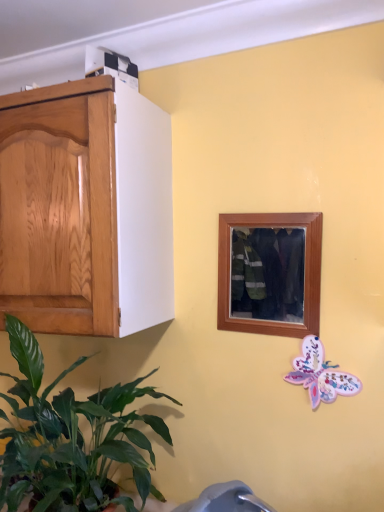
Question: From the image's perspective, does green leafy plant at lower left appear lower than wooden picture frame at center?

Choices:
 (A) yes
 (B) no

Answer: (A)

Question: Is green leafy plant at lower left located outside wooden picture frame at center?

Choices:
 (A) yes
 (B) no

Answer: (A)

Question: Does green leafy plant at lower left appear on the right side of wooden picture frame at center?

Choices:
 (A) yes
 (B) no

Answer: (B)

Question: Is the position of green leafy plant at lower left more distant than that of wooden picture frame at center?

Choices:
 (A) yes
 (B) no

Answer: (B)

Question: Is green leafy plant at lower left oriented towards wooden picture frame at center?

Choices:
 (A) no
 (B) yes

Answer: (A)

Question: From a real-world perspective, is green leafy plant at lower left over wooden picture frame at center?

Choices:
 (A) no
 (B) yes

Answer: (A)

Question: Considering the relative positions of green leafy plant at lower left and pastel paper butterfly at lower right in the image provided, is green leafy plant at lower left to the right of pastel paper butterfly at lower right from the viewer's perspective?

Choices:
 (A) no
 (B) yes

Answer: (A)

Question: Does green leafy plant at lower left touch pastel paper butterfly at lower right?

Choices:
 (A) no
 (B) yes

Answer: (A)

Question: Is green leafy plant at lower left positioned behind pastel paper butterfly at lower right?

Choices:
 (A) yes
 (B) no

Answer: (B)

Question: Can you confirm if green leafy plant at lower left is taller than pastel paper butterfly at lower right?

Choices:
 (A) yes
 (B) no

Answer: (A)

Question: Is green leafy plant at lower left looking in the opposite direction of pastel paper butterfly at lower right?

Choices:
 (A) no
 (B) yes

Answer: (A)

Question: Is green leafy plant at lower left smaller than pastel paper butterfly at lower right?

Choices:
 (A) yes
 (B) no

Answer: (B)

Question: Is wooden picture frame at center bigger than pastel paper butterfly at lower right?

Choices:
 (A) no
 (B) yes

Answer: (B)